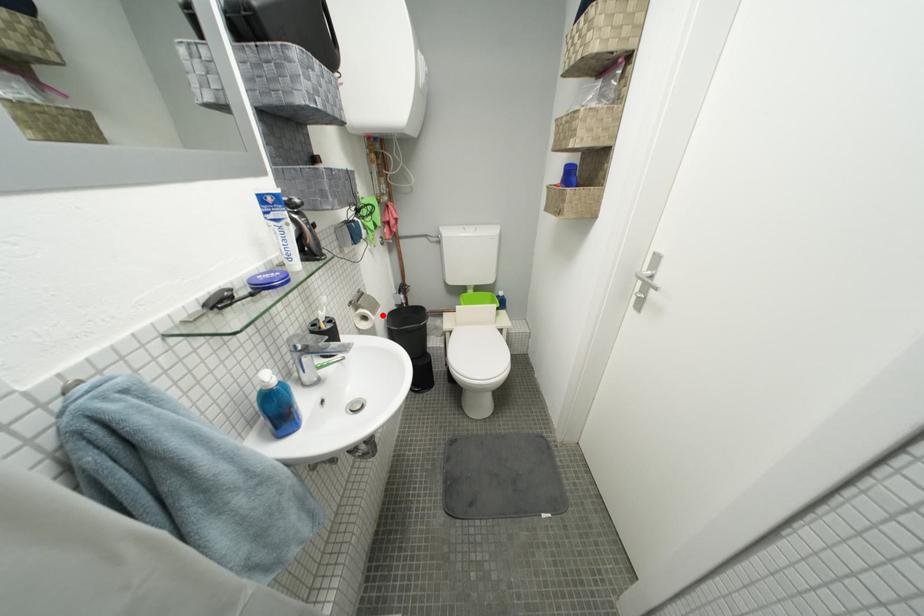
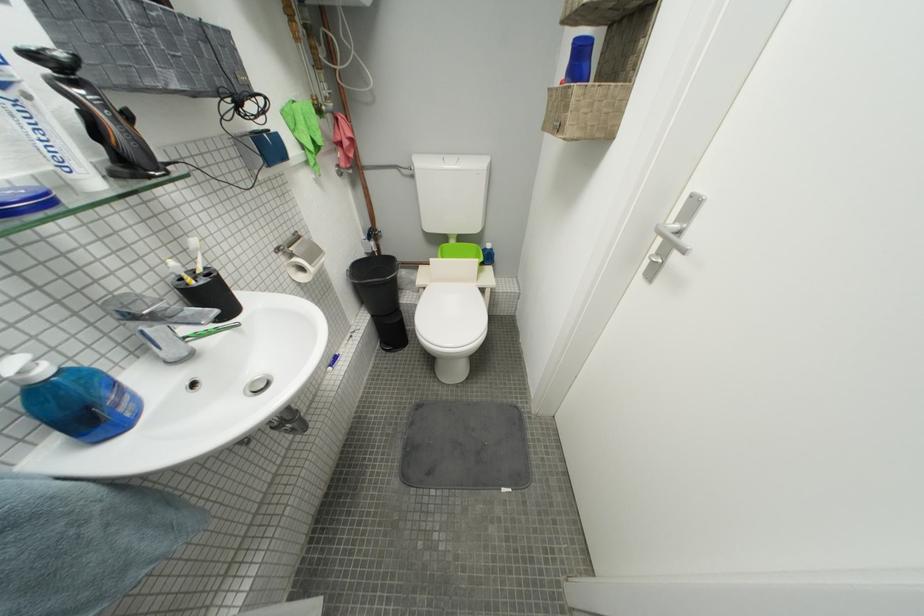
Question: I am providing you with two images of the same scene from different viewpoints. Given a red point in image1, look at the same physical point in image2. Is it:

Choices:
 (A) Closer to the viewpoint
 (B) Farther from the viewpoint

Answer: (B)